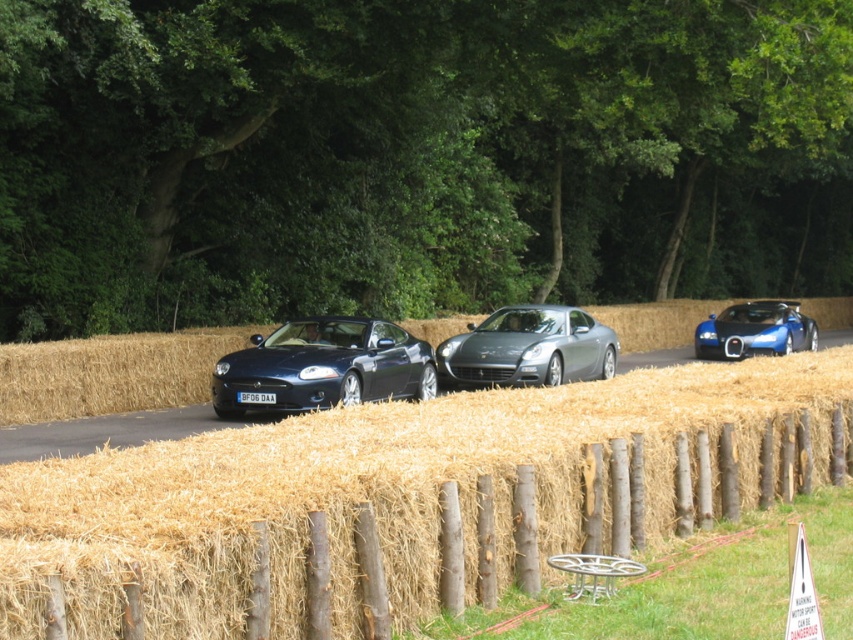
You are a photographer positioned at the midpoint between the glossy metallic car at center and the blue glossy sports car at right. You want to capture a shot where both cars are in frame without moving your position. Given that your camera has a maximum zoom range of 50 feet, can you fit both cars into the photo?

The glossy metallic car at center is 47.88 feet away from the blue glossy sports car at right. Since your position is at the midpoint, each car is approximately 23.94 feet away from you. The maximum zoom range of 50 feet allows you to capture objects up to that distance, so yes, both cars can be included in the photo as they are within the camera range.

You are a photographer wanting to capture the blue glossy sports car at right without the wooden post fence at center blocking the view. Based on their heights, is this possible?

The wooden post fence at center is shorter than the blue glossy sports car at right, so the photographer can position themselves higher or angle the camera to capture the car above the fence.